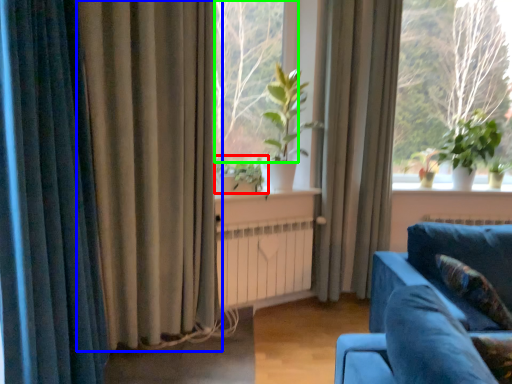
Question: Which object is the closest to the plant (highlighted by a red box)? Choose among these: curtain (highlighted by a blue box) or window screen (highlighted by a green box).

Choices:
 (A) curtain
 (B) window screen

Answer: (A)